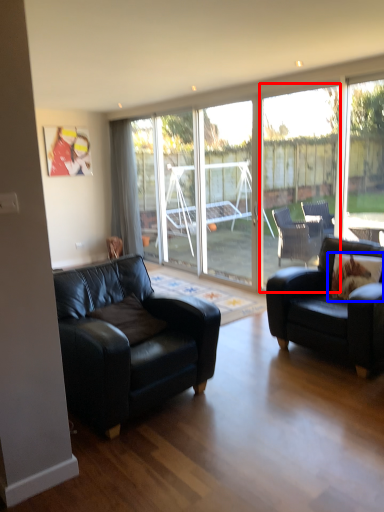
Question: Which point is further to the camera, window (highlighted by a red box) or pillow (highlighted by a blue box)?

Choices:
 (A) window
 (B) pillow

Answer: (A)